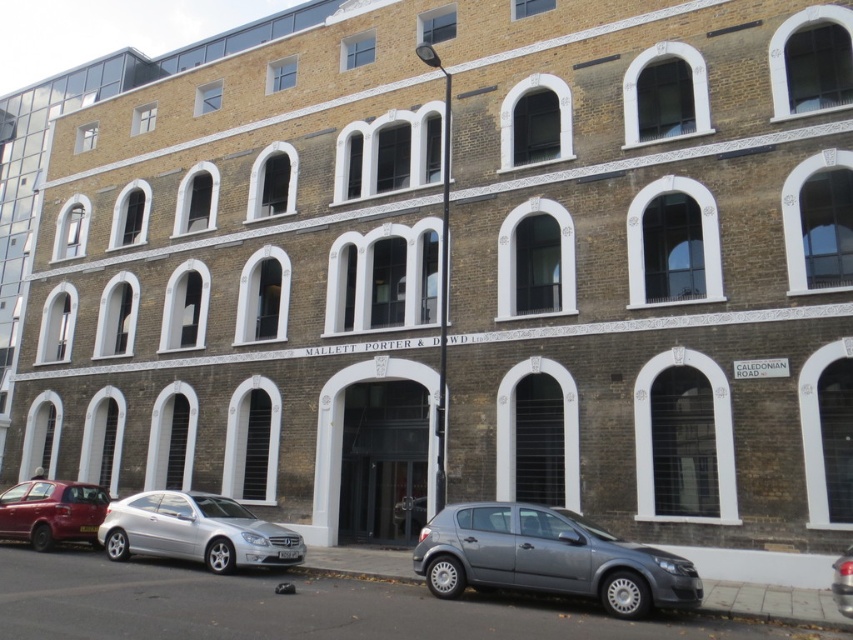
You are a delivery person needing to park your van between the silver metallic car at lower left and the metallic silver car at lower right. Can your van, which is 6 meters long, fit in the space between them?

The space between the silver metallic car at lower left and the metallic silver car at lower right is not specified in the provided description, so it is impossible to determine if the van can fit.